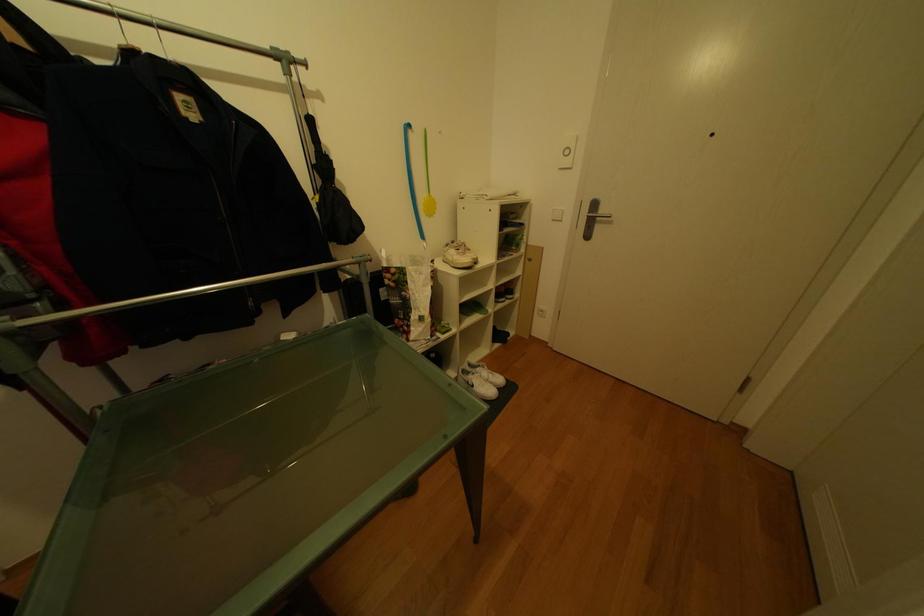
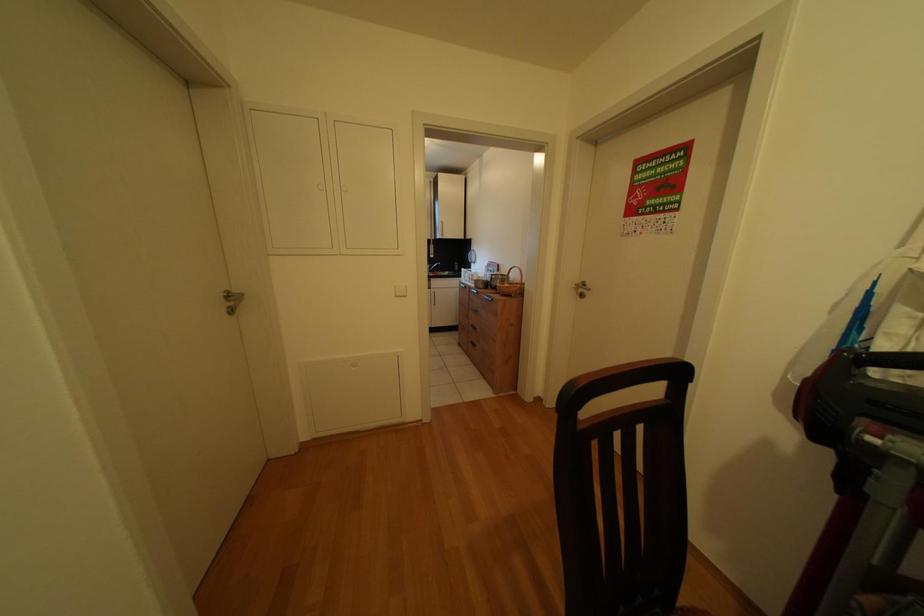
The images are taken continuously from a first-person perspective. In which direction is your viewpoint rotating?

The camera rotated toward left-down.